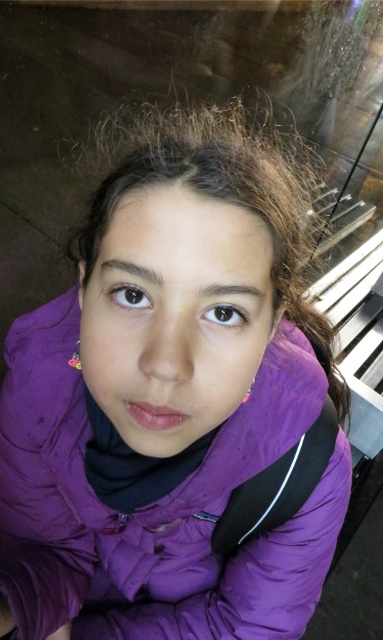
You are taking a photo of the person in the purple puffer jacket. You want to focus on the point closer to the camera. Which point should you choose between point (145, 296) and point (240, 314)?

Point (145, 296) is closer to the camera than point (240, 314), so you should choose point (145, 296) to focus on.

You are a photographer trying to focus on the person in the image. You notice a point at coordinates (x=129, y=296). Where is this point located in relation to the person?

The point at coordinates (x=129, y=296) is on the brown matte eye at upper center.